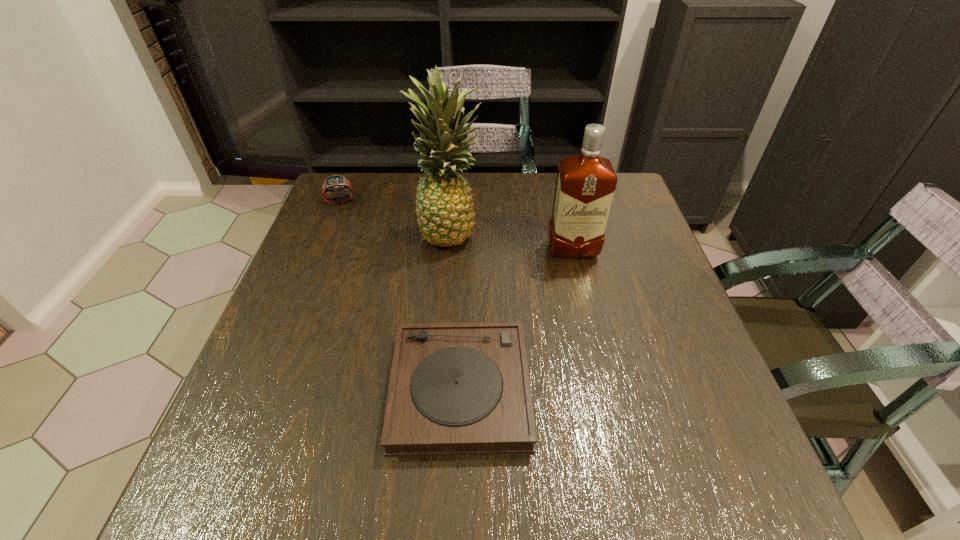
Where is `vacant region located 0.110m on the back of the shortest object`? Image resolution: width=960 pixels, height=540 pixels. vacant region located 0.110m on the back of the shortest object is located at coordinates (464, 297).

At what (x,y) coordinates should I click in order to perform the action: click on pineapple situated at the far edge. Please return your answer as a coordinate pair (x, y). The width and height of the screenshot is (960, 540). Looking at the image, I should click on (444, 206).

The image size is (960, 540). Identify the location of watch that is at the far edge. (334, 183).

Identify the location of object that is at the left edge. This screenshot has height=540, width=960. (334, 183).

I want to click on object that is at the right edge, so click(585, 185).

Image resolution: width=960 pixels, height=540 pixels. Identify the location of object located at the far left corner. (334, 183).

In the image, there is a desktop. At what (x,y) coordinates should I click in order to perform the action: click on vacant space at the far edge. Please return your answer as a coordinate pair (x, y). The width and height of the screenshot is (960, 540). Looking at the image, I should click on (391, 219).

Locate an element on the screen. vacant region at the near edge of the desktop is located at coordinates (398, 514).

The height and width of the screenshot is (540, 960). I want to click on vacant space at the left edge of the desktop, so click(243, 453).

This screenshot has width=960, height=540. I want to click on free space at the right edge of the desktop, so click(x=644, y=271).